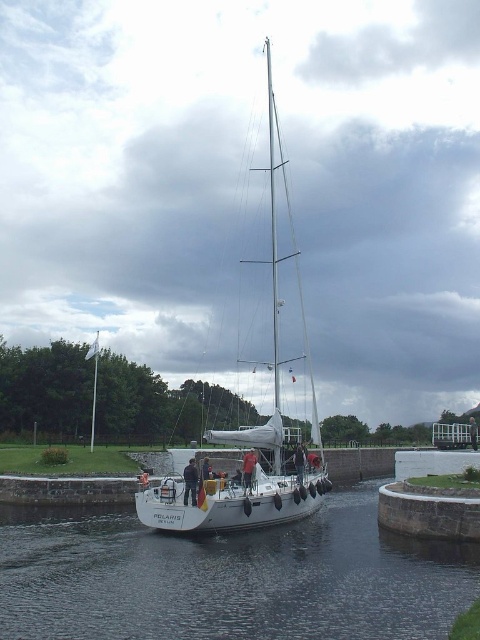
You are a photographer standing on the dock and want to take a picture of the clear water at center and the brown leather jacket at center. Which object will appear larger in your photo?

The brown leather jacket at center will appear larger in the photo since it is larger than the clear water at center.

You are a photographer planning to take a photo of the sailboat named POLARIS in the canal. You notice two people on the boat, a black fabric person at center and a reddish skin human at center. Which person would appear bigger in the photo?

The black fabric person at center would appear bigger in the photo because it is larger in size than the reddish skin human at center.